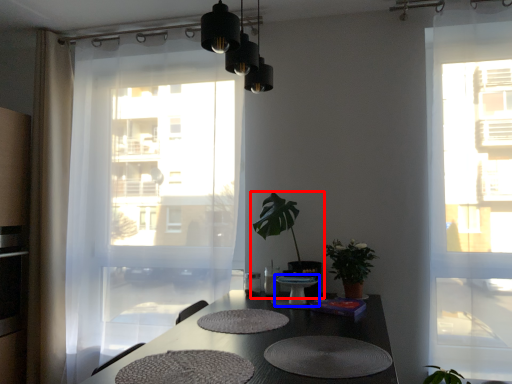
Question: Which object appears closest to the camera in this image, houseplant (highlighted by a red box) or round table (highlighted by a blue box)?

Choices:
 (A) houseplant
 (B) round table

Answer: (B)